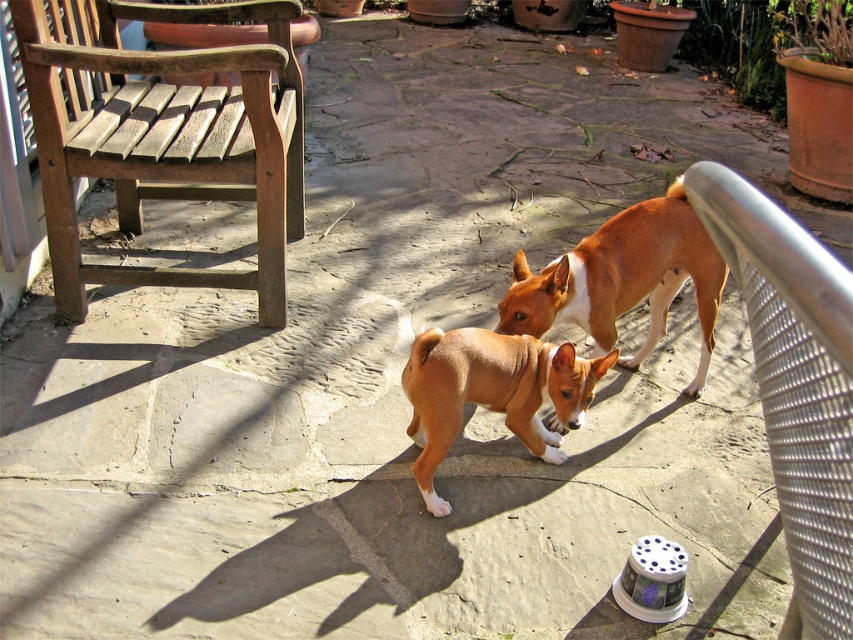
You are a photographer positioned at the origin point of the image. You want to capture a closeup of the brown smooth dog at center without moving your camera. Based on its coordinates, can you confirm if the dog is already centered in your current frame?

The brown smooth dog at center is located at point (624, 280), which means it is not exactly centered in the frame since the center of the image would be at coordinates (426, 320). Therefore, the dog is slightly to the left and below the center point.